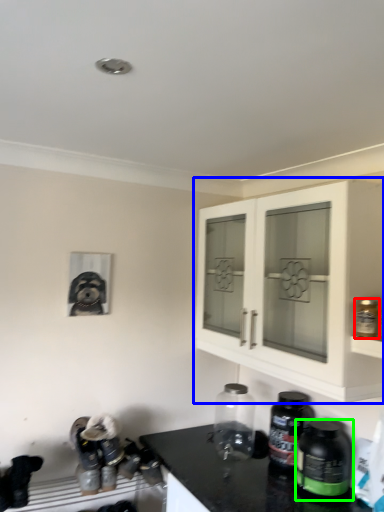
Question: Based on their relative distances, which object is farther from bottle (highlighted by a red box)? Choose from cabinetry (highlighted by a blue box) and bottle (highlighted by a green box).

Choices:
 (A) cabinetry
 (B) bottle

Answer: (B)